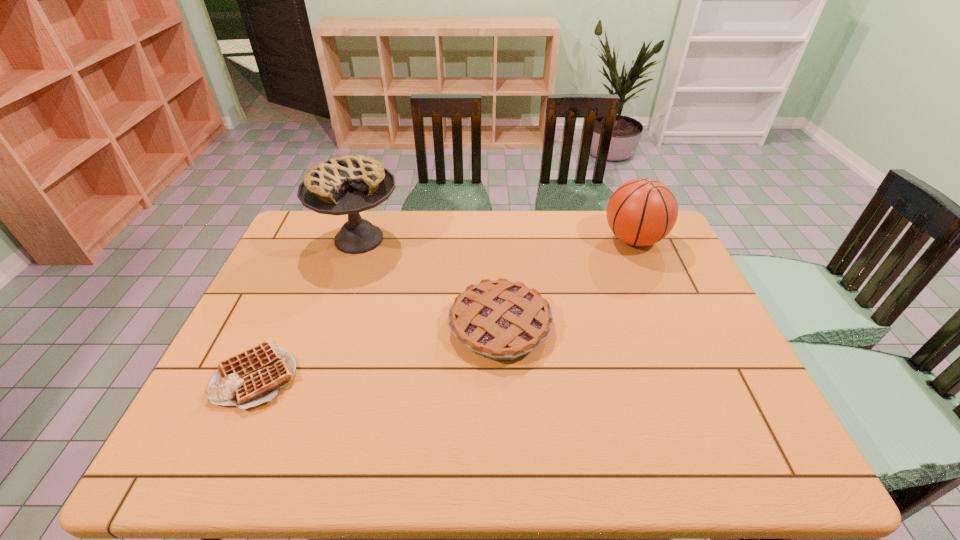
Find the location of a particular element. The height and width of the screenshot is (540, 960). vacant space located 0.240m on the right of the waffle is located at coordinates (396, 375).

Where is `pie that is positioned at the far edge`? Image resolution: width=960 pixels, height=540 pixels. pie that is positioned at the far edge is located at coordinates (351, 184).

Identify the location of basketball present at the far edge. The image size is (960, 540). (641, 212).

In order to click on pie located in the left edge section of the desktop in this screenshot , I will do `click(351, 184)`.

The image size is (960, 540). Find the location of `waffle present at the left edge`. waffle present at the left edge is located at coordinates (250, 378).

Locate an element on the screen. This screenshot has width=960, height=540. object positioned at the right edge is located at coordinates (641, 212).

Locate an element on the screen. This screenshot has height=540, width=960. object that is at the far left corner is located at coordinates (351, 184).

Where is `object that is at the far right corner`? object that is at the far right corner is located at coordinates (641, 212).

In the image, there is a desktop. Identify the location of vacant space at the far edge. The width and height of the screenshot is (960, 540). pyautogui.click(x=541, y=223).

You are a GUI agent. You are given a task and a screenshot of the screen. Output one action in this format:
    pyautogui.click(x=<x>, y=<y>)
    Task: Click on the vacant position at the near edge of the desktop
    The width and height of the screenshot is (960, 540).
    Given the screenshot: What is the action you would take?
    pos(658,450)